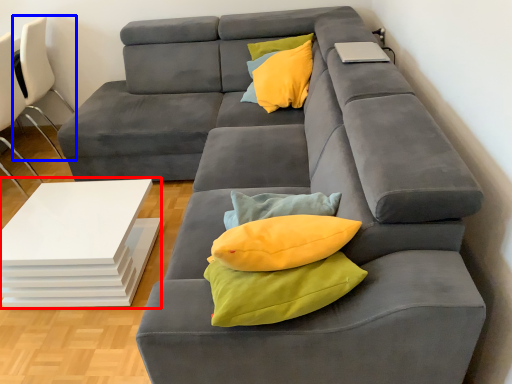
Question: Which object is closer to the camera taking this photo, table (highlighted by a red box) or chair (highlighted by a blue box)?

Choices:
 (A) table
 (B) chair

Answer: (A)